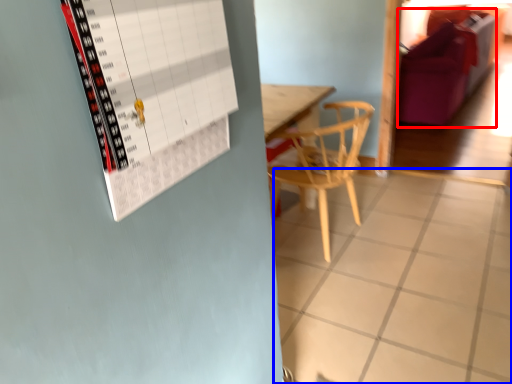
Question: Among these objects, which one is nearest to the camera, couch (highlighted by a red box) or tile (highlighted by a blue box)?

Choices:
 (A) couch
 (B) tile

Answer: (B)